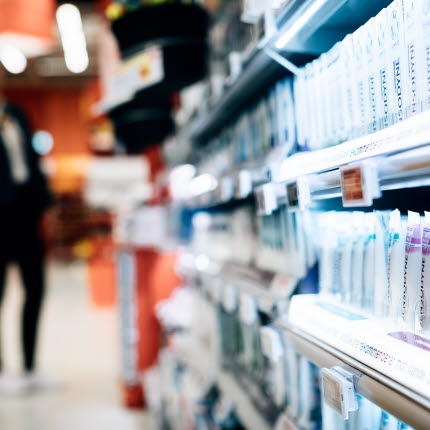
Locate an element on the screen. brown trim on shelf is located at coordinates (403, 409).